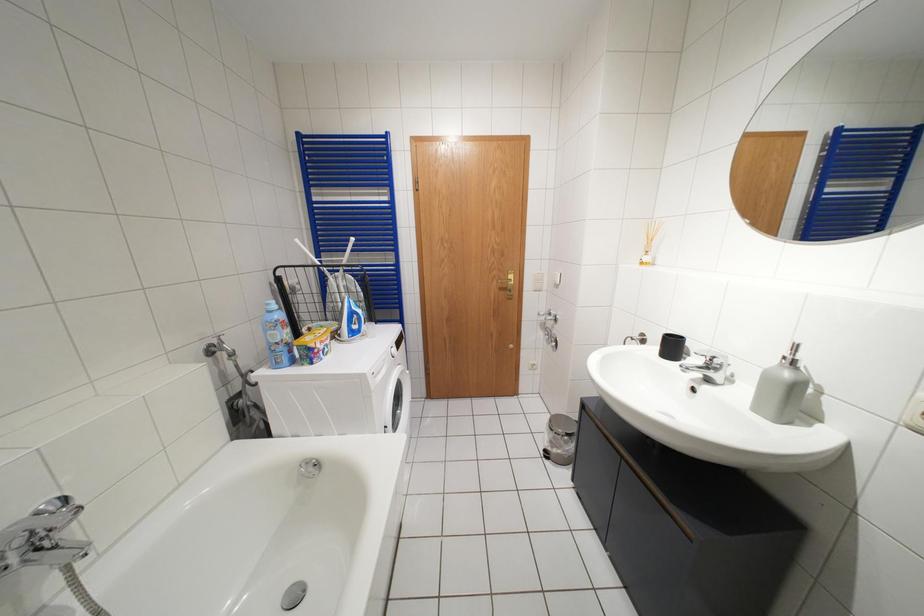
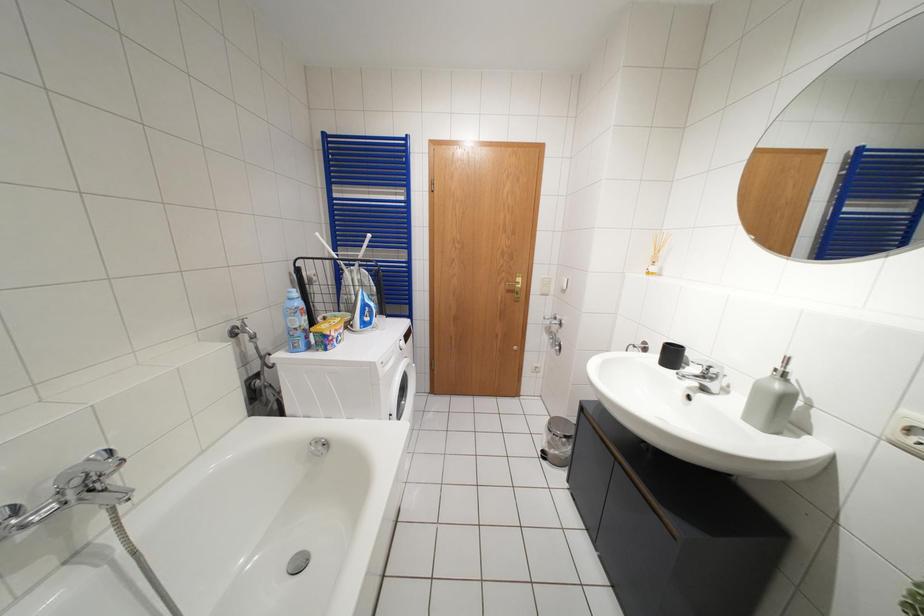
Question: The camera is either moving clockwise (left) or counter-clockwise (right) around the object. The first image is from the beginning of the video and the second image is from the end. Is the camera moving left or right when shooting the video?

Choices:
 (A) Left
 (B) Right

Answer: (B)